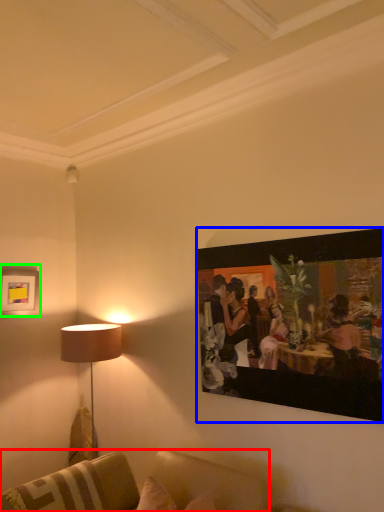
Question: Which object is positioned farthest from studio couch (highlighted by a red box)? Select from picture frame (highlighted by a blue box) and picture frame (highlighted by a green box).

Choices:
 (A) picture frame
 (B) picture frame

Answer: (B)